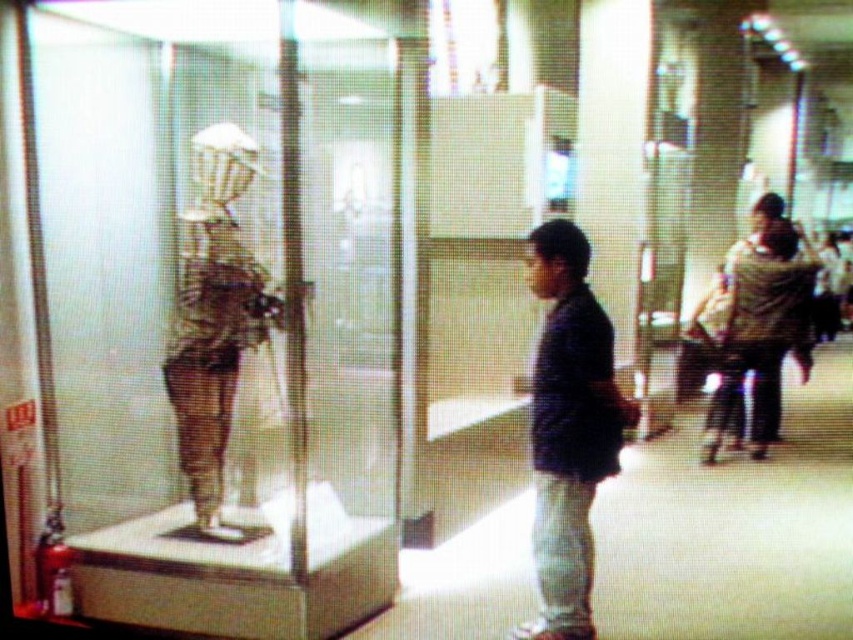
Question: Which object appears farthest from the camera in this image?

Choices:
 (A) dark blue shirt at center
 (B) brown textured jacket at right
 (C) brown wooden skeleton at center

Answer: (C)

Question: Which point is closer to the camera taking this photo?

Choices:
 (A) (231, 540)
 (B) (758, 401)

Answer: (B)

Question: Does dark blue shirt at center appear over brown textured jacket at right?

Choices:
 (A) yes
 (B) no

Answer: (B)

Question: Can you confirm if brown wooden skeleton at center is wider than brown textured jacket at right?

Choices:
 (A) yes
 (B) no

Answer: (A)

Question: Which of the following is the farthest from the observer?

Choices:
 (A) (775, 400)
 (B) (213, 513)

Answer: (B)

Question: Can you confirm if brown wooden skeleton at center is positioned to the left of brown textured jacket at right?

Choices:
 (A) no
 (B) yes

Answer: (B)